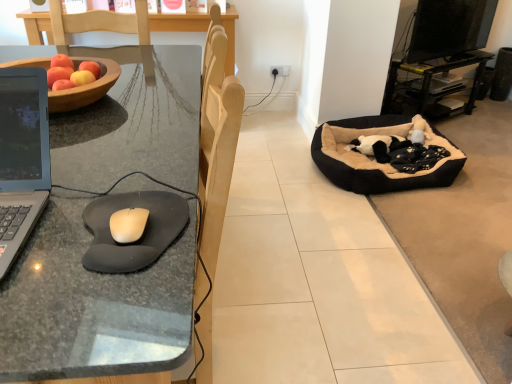
The width and height of the screenshot is (512, 384). What are the coordinates of `vacant point to the right of wooden bowl at left` in the screenshot? It's located at (157, 109).